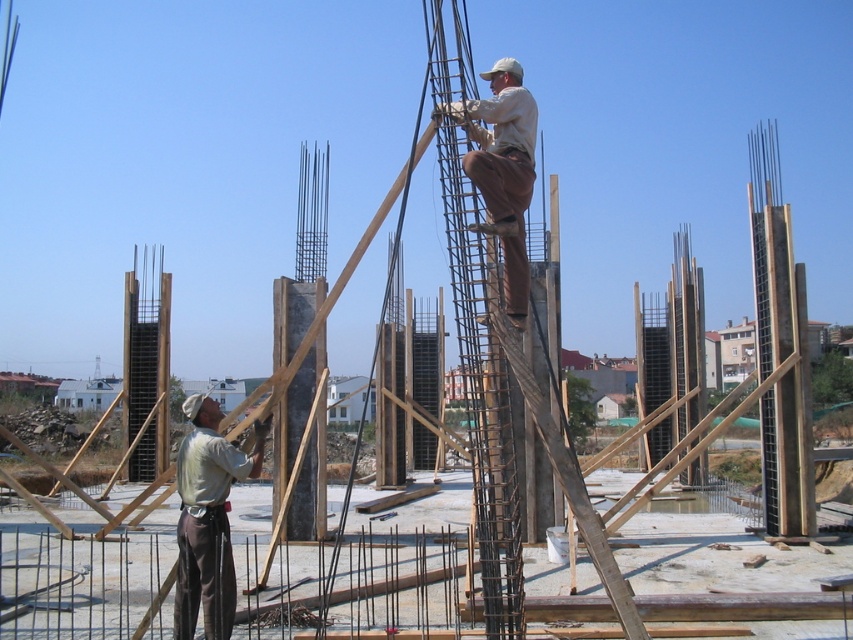
You are a safety inspector observing the construction site. You notice the gray cotton shirt at lower left and the brown cotton pants at upper center. Which clothing item appears bigger in the image?

The gray cotton shirt at lower left has a larger size compared to the brown cotton pants at upper center, so the gray cotton shirt at lower left appears bigger.

You are a safety inspector at the construction site. You need to ensure that the rusty metal ladder at center is tall enough to reach the top of the gray cotton shirt at lower left. Is the ladder tall enough?

The rusty metal ladder at center has a greater height compared to gray cotton shirt at lower left, so yes, the ladder is tall enough to reach the top of the gray cotton shirt at lower left.